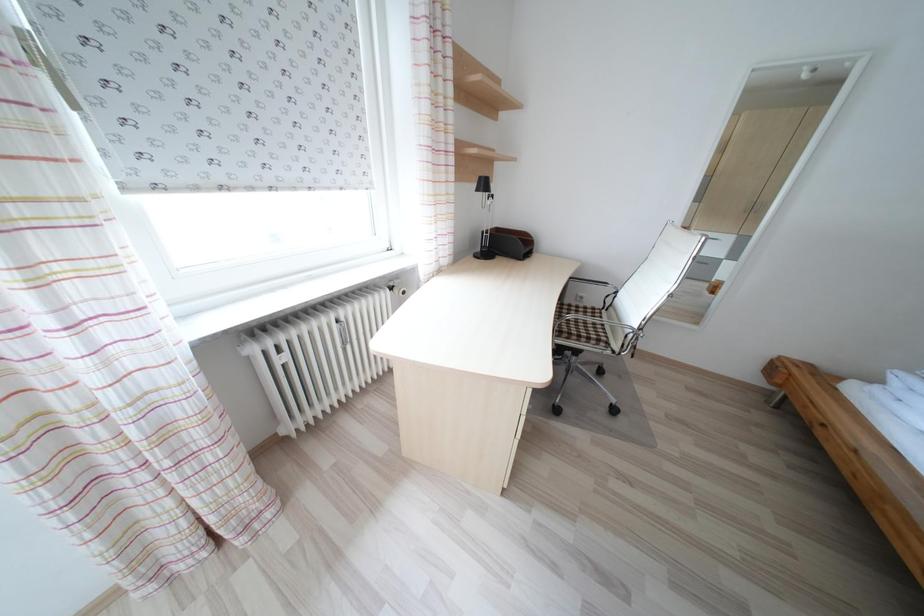
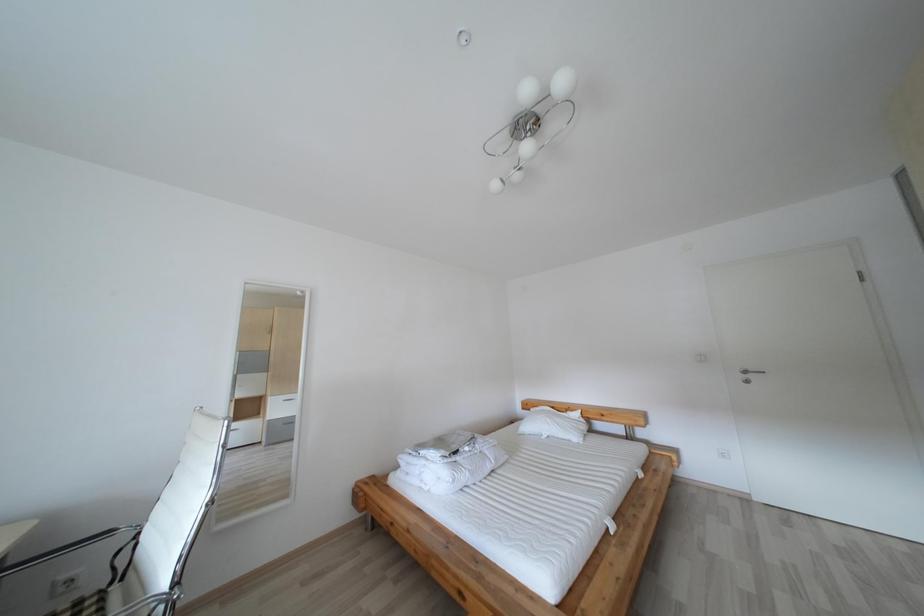
Question: Based on the continuous images, in which direction is the camera rotating? Reply with the corresponding letter.

Choices:
 (A) Left
 (B) Right
 (C) Up
 (D) Down

Answer: (B)